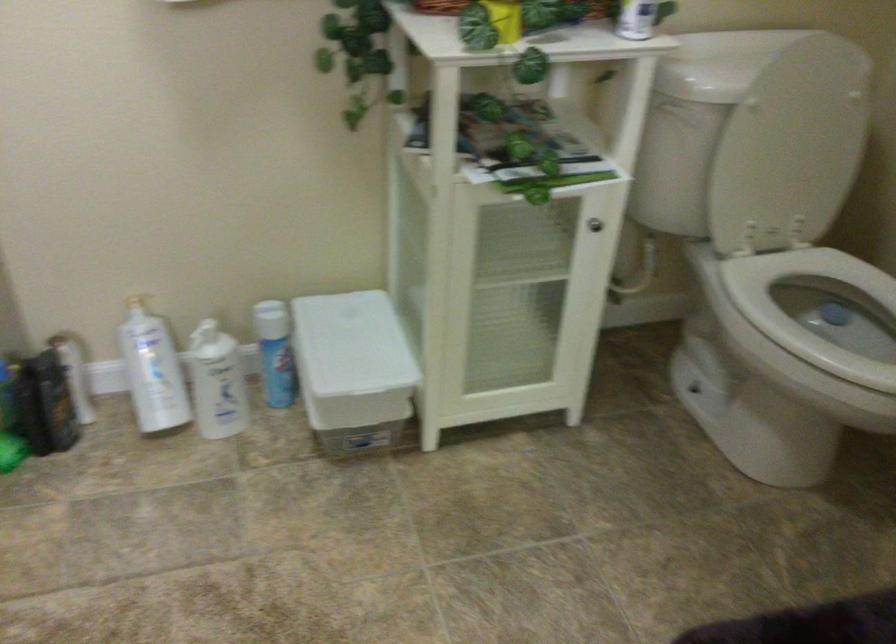
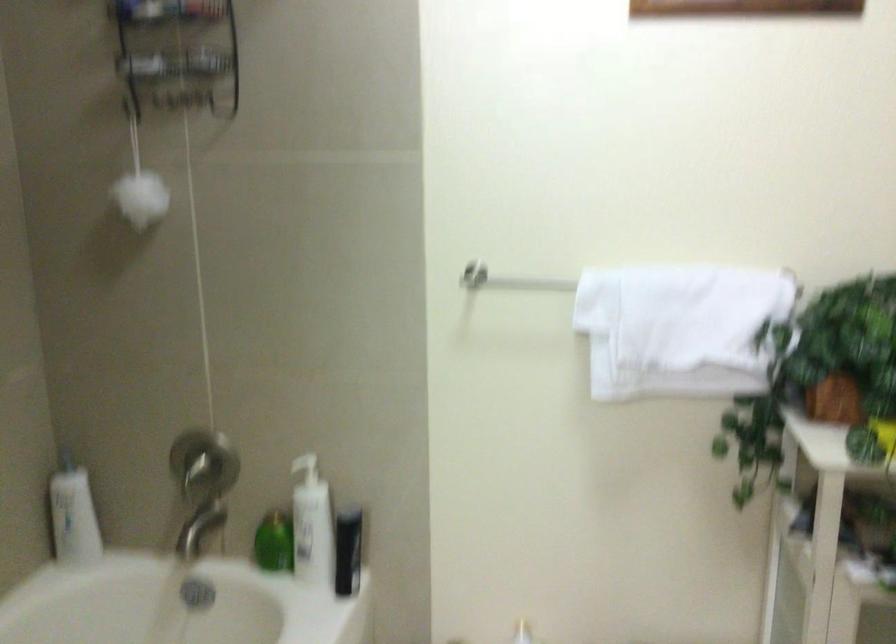
The images are taken continuously from a first-person perspective. In which direction is your viewpoint rotating?

The rotation direction of the camera is left-up.